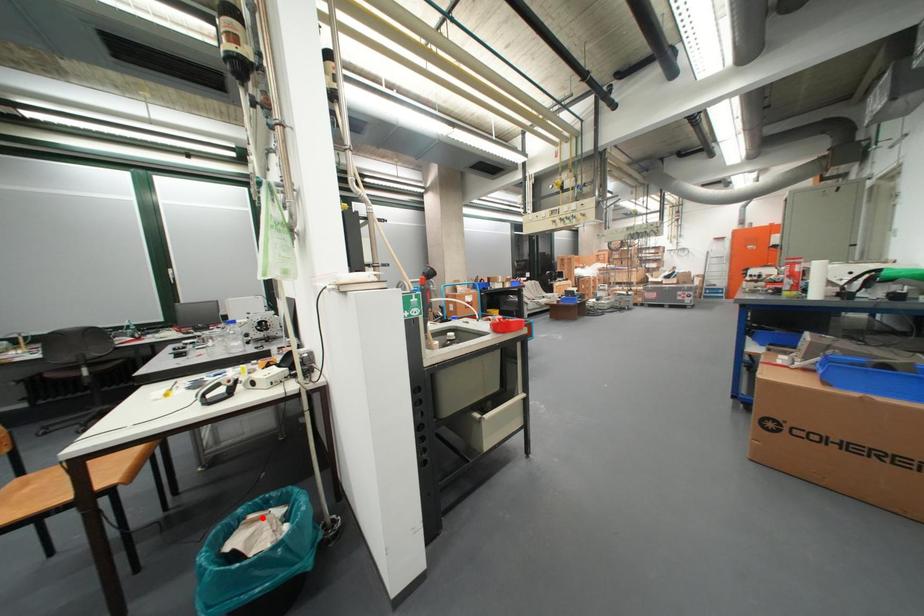
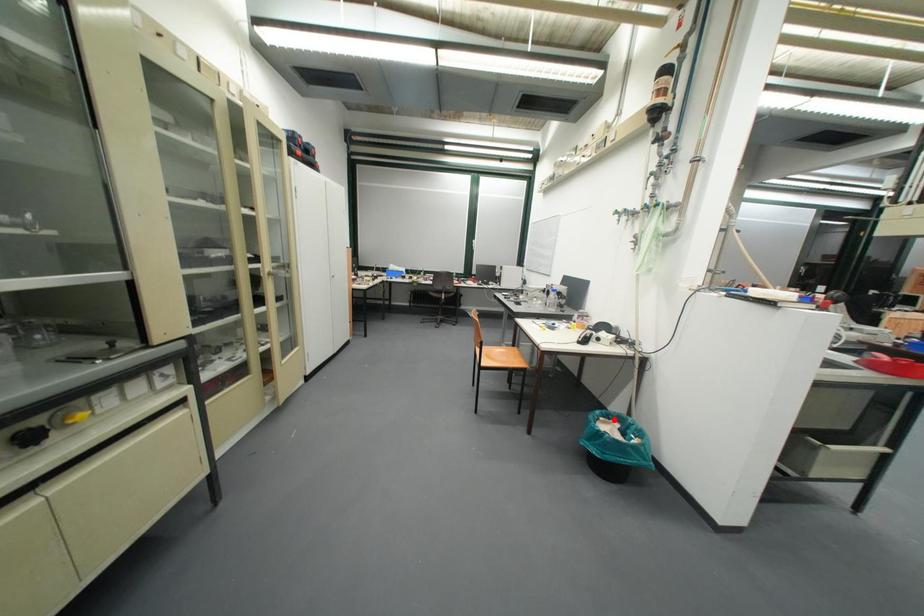
I am providing you with two images of the same scene from different viewpoints. A red point is marked on the first image and another point is marked on the second image. Do the highlighted points in image1 and image2 indicate the same real-world spot?

Yes